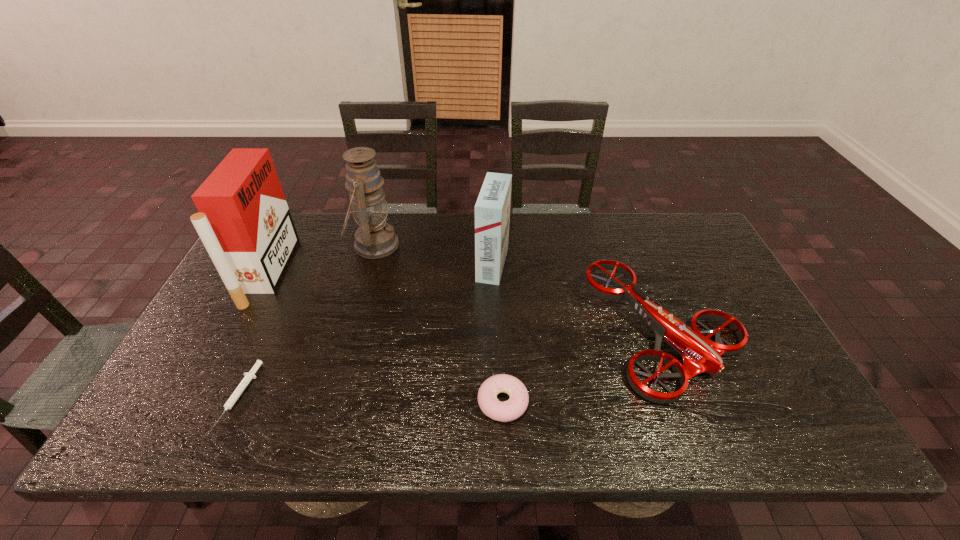
At what (x,y) coordinates should I click in order to perform the action: click on vacant space that satisfies the following two spatial constraints: 1. on the front-facing side of the left cigarette case; 2. on the back side of the fourth tallest object. Please return your answer as a coordinate pair (x, y). The image size is (960, 540). Looking at the image, I should click on point(236,333).

You are a GUI agent. You are given a task and a screenshot of the screen. Output one action in this format:
    pyautogui.click(x=<x>, y=<y>)
    Task: Click on the free spot that satisfies the following two spatial constraints: 1. on the front-facing side of the syringe; 2. on the right side of the left cigarette case
    This screenshot has width=960, height=540.
    Given the screenshot: What is the action you would take?
    pyautogui.click(x=204, y=395)